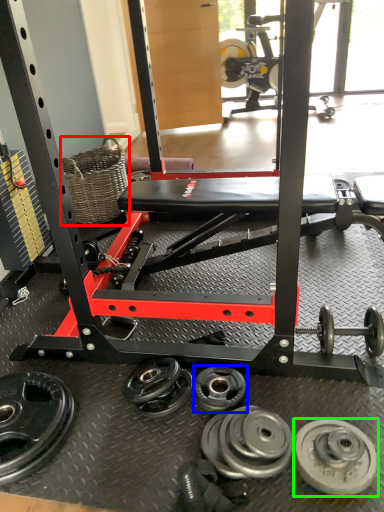
Question: Considering the real-world distances, which object is closest to basket (highlighted by a red box)? wheel (highlighted by a blue box) or wheel (highlighted by a green box).

Choices:
 (A) wheel
 (B) wheel

Answer: (A)